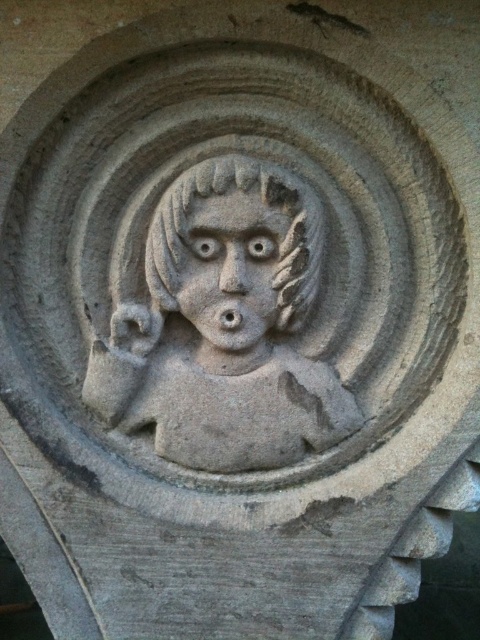
Which of these two, gray stone deity at center or stone textured face at center, stands taller?

Standing taller between the two is gray stone deity at center.

Between gray stone deity at center and stone textured face at center, which one is positioned lower?

gray stone deity at center is lower down.

What do you see at coordinates (225, 326) in the screenshot?
I see `gray stone deity at center` at bounding box center [225, 326].

The width and height of the screenshot is (480, 640). I want to click on gray stone deity at center, so click(x=225, y=326).